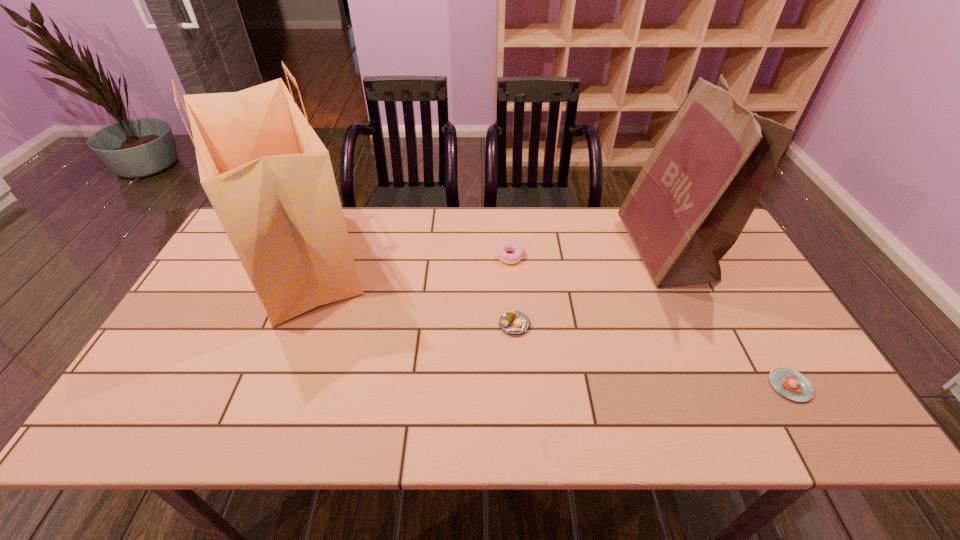
Image resolution: width=960 pixels, height=540 pixels. I want to click on free space located on the front of the farthest pastry, so click(x=516, y=328).

Where is `vacant space located 0.330m on the back of the second farthest pastry`? vacant space located 0.330m on the back of the second farthest pastry is located at coordinates (508, 237).

I want to click on vacant space located 0.390m on the left of the rightmost pastry, so click(x=603, y=386).

Find the location of a particular element. This screenshot has height=540, width=960. pastry positioned at the far edge is located at coordinates (518, 249).

Identify the location of object at the near edge. coord(790,383).

At what (x,y) coordinates should I click in order to perform the action: click on object present at the left edge. Please return your answer as a coordinate pair (x, y). Image resolution: width=960 pixels, height=540 pixels. Looking at the image, I should click on (268, 176).

Identify the location of grocery bag positioned at the right edge. (690, 202).

The image size is (960, 540). Find the location of `pastry at the right edge`. pastry at the right edge is located at coordinates (790, 383).

Locate an element on the screen. object located in the far left corner section of the desktop is located at coordinates (268, 176).

The width and height of the screenshot is (960, 540). I want to click on object positioned at the far right corner, so click(x=690, y=202).